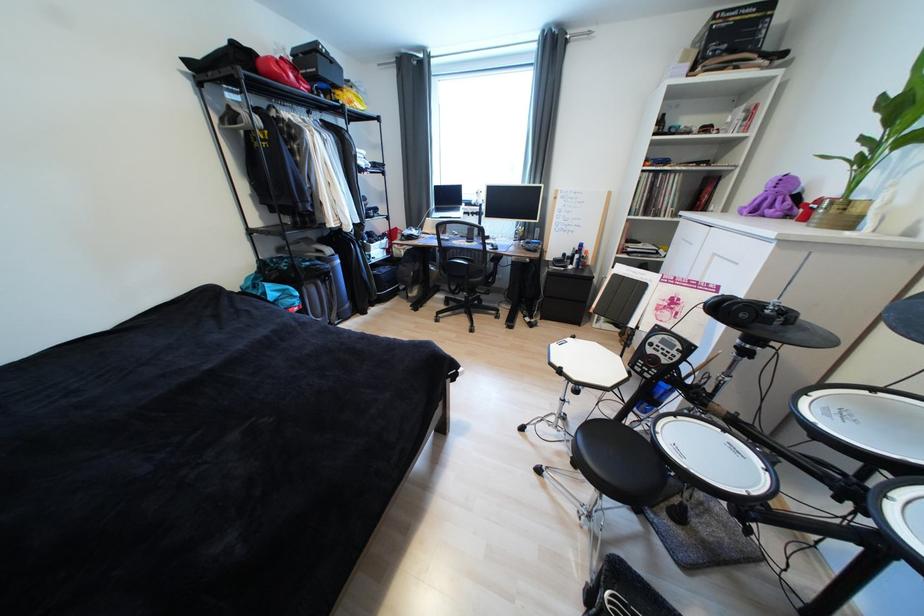
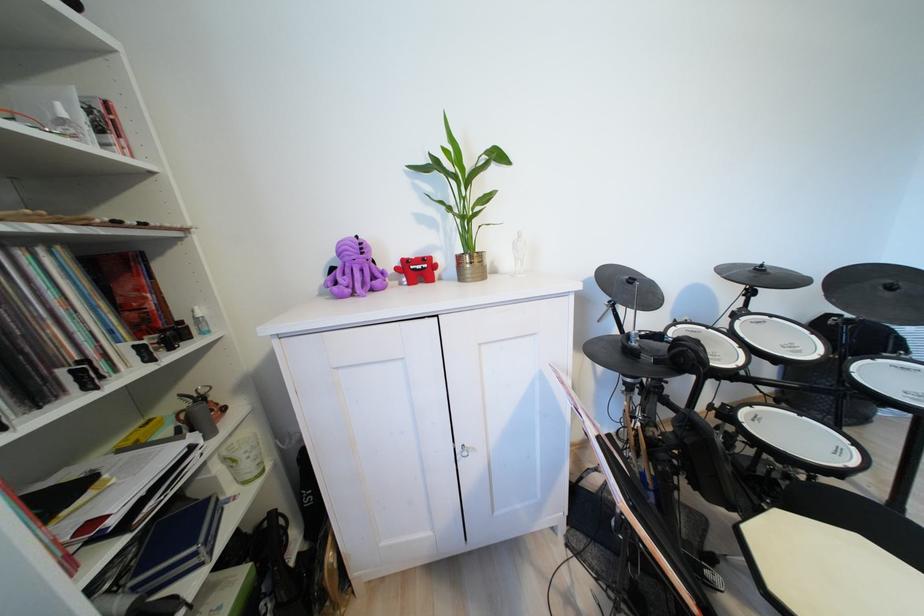
Locate, in the second image, the point that corresponds to point 828,201 in the first image.

(411, 262)